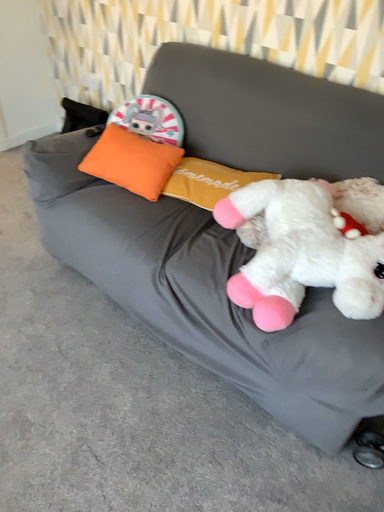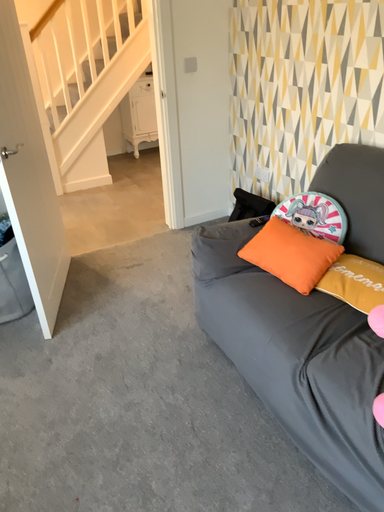
Question: How did the camera likely rotate when shooting the video?

Choices:
 (A) rotated left
 (B) rotated right

Answer: (A)